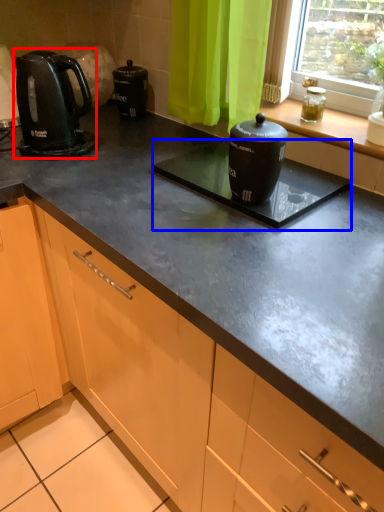
Question: Which of the following is the closest to the observer, kitchen appliance (highlighted by a red box) or appliance (highlighted by a blue box)?

Choices:
 (A) kitchen appliance
 (B) appliance

Answer: (B)